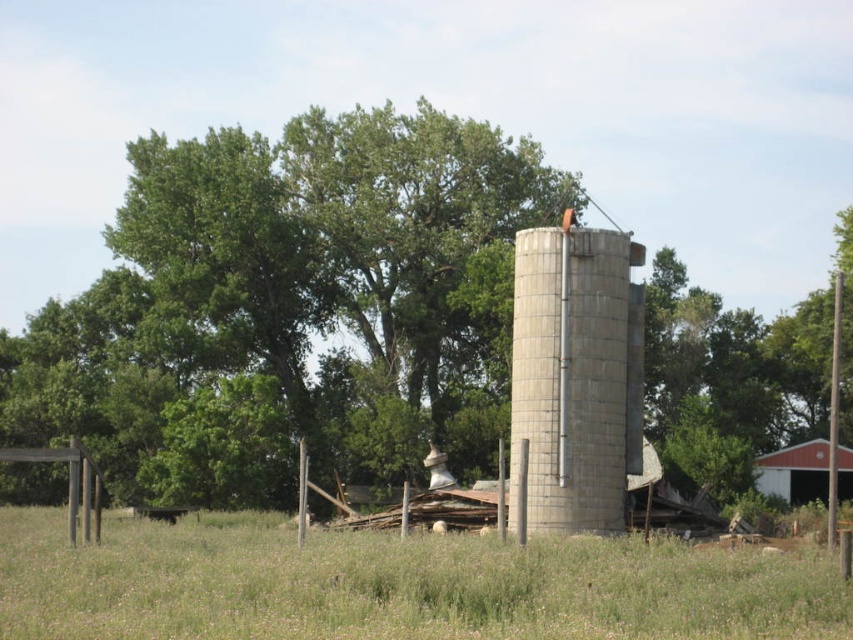
Question: Which object is closer to the camera taking this photo?

Choices:
 (A) green grass at center
 (B) gray concrete silo at center
 (C) red wood barn at lower right

Answer: (A)

Question: Is green grass at center to the right of red wood barn at lower right from the viewer's perspective?

Choices:
 (A) no
 (B) yes

Answer: (A)

Question: Considering the relative positions of green grass at center and red wood barn at lower right in the image provided, where is green grass at center located with respect to red wood barn at lower right?

Choices:
 (A) left
 (B) right

Answer: (A)

Question: Can you confirm if gray concrete silo at center is wider than red wood barn at lower right?

Choices:
 (A) no
 (B) yes

Answer: (B)

Question: Which object is farther from the camera taking this photo?

Choices:
 (A) gray concrete silo at center
 (B) green grass at center
 (C) red wood barn at lower right

Answer: (C)

Question: Estimate the real-world distances between objects in this image. Which object is closer to the red wood barn at lower right?

Choices:
 (A) green grass at center
 (B) gray concrete silo at center

Answer: (B)